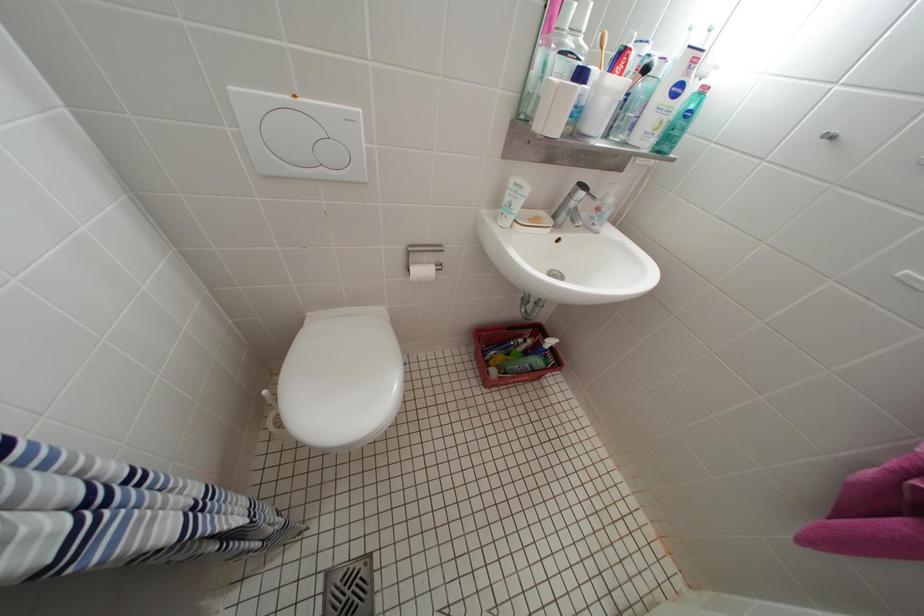
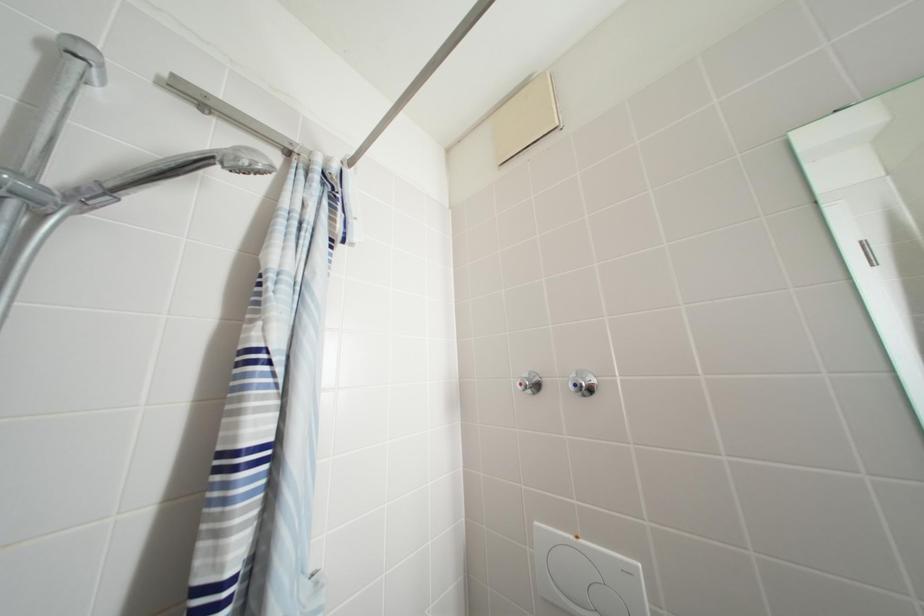
The images are taken continuously from a first-person perspective. In which direction is your viewpoint rotating?

The camera's rotation is toward left-up.